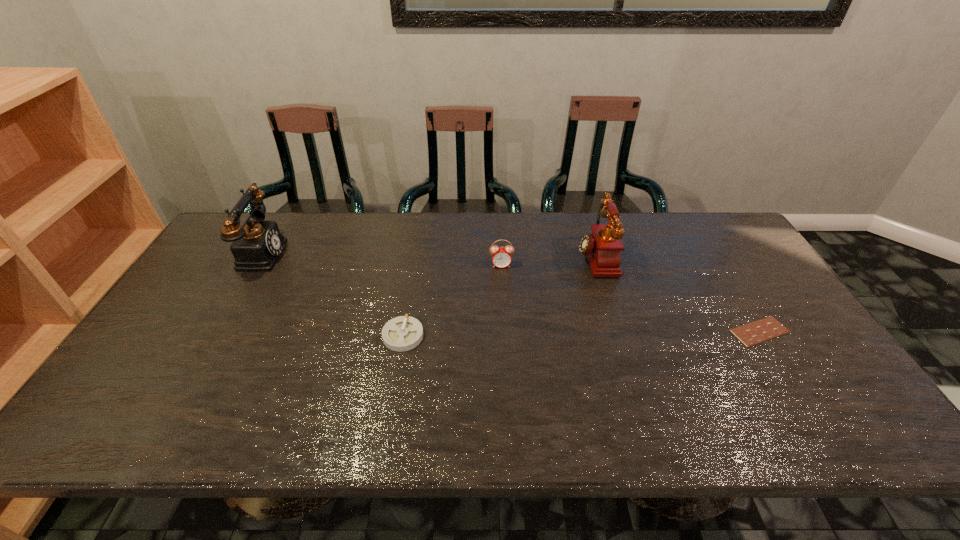
Identify the location of the leftmost object. Image resolution: width=960 pixels, height=540 pixels. (256, 246).

Locate an element on the screen. Image resolution: width=960 pixels, height=540 pixels. the right telephone is located at coordinates (602, 247).

The height and width of the screenshot is (540, 960). Identify the location of alarm clock. (501, 257).

Locate an element on the screen. Image resolution: width=960 pixels, height=540 pixels. the third object from right to left is located at coordinates (501, 257).

Identify the location of ashtray. This screenshot has height=540, width=960. [403, 333].

Image resolution: width=960 pixels, height=540 pixels. I want to click on the second object from left to right, so click(x=403, y=333).

You are a GUI agent. You are given a task and a screenshot of the screen. Output one action in this format:
    pyautogui.click(x=<x>, y=<y>)
    Task: Click on the chocolate bar
    This screenshot has height=540, width=960.
    Given the screenshot: What is the action you would take?
    pyautogui.click(x=750, y=334)

This screenshot has width=960, height=540. Identify the location of the shortest object. (750, 334).

Locate an element on the screen. free region located on the front of the leftmost object at the rotary dial is located at coordinates (337, 253).

You are a GUI agent. You are given a task and a screenshot of the screen. Output one action in this format:
    pyautogui.click(x=<x>, y=<y>)
    Task: Click on the vacant space located on the dial of the second object from right to left
    
    Given the screenshot: What is the action you would take?
    pyautogui.click(x=463, y=256)